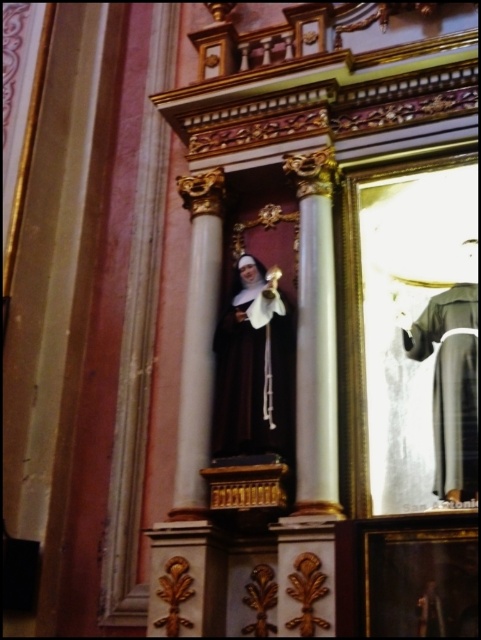
Question: Is matte black statue at center thinner than gray matte robe at right?

Choices:
 (A) yes
 (B) no

Answer: (B)

Question: Does matte black statue at center appear over gray matte robe at right?

Choices:
 (A) no
 (B) yes

Answer: (B)

Question: Which of the following is the farthest from the observer?

Choices:
 (A) gray matte robe at right
 (B) matte black statue at center

Answer: (B)

Question: Which point appears closest to the camera in this image?

Choices:
 (A) (x=454, y=288)
 (B) (x=251, y=380)

Answer: (B)

Question: Can you confirm if matte black statue at center is positioned to the left of gray matte robe at right?

Choices:
 (A) yes
 (B) no

Answer: (A)